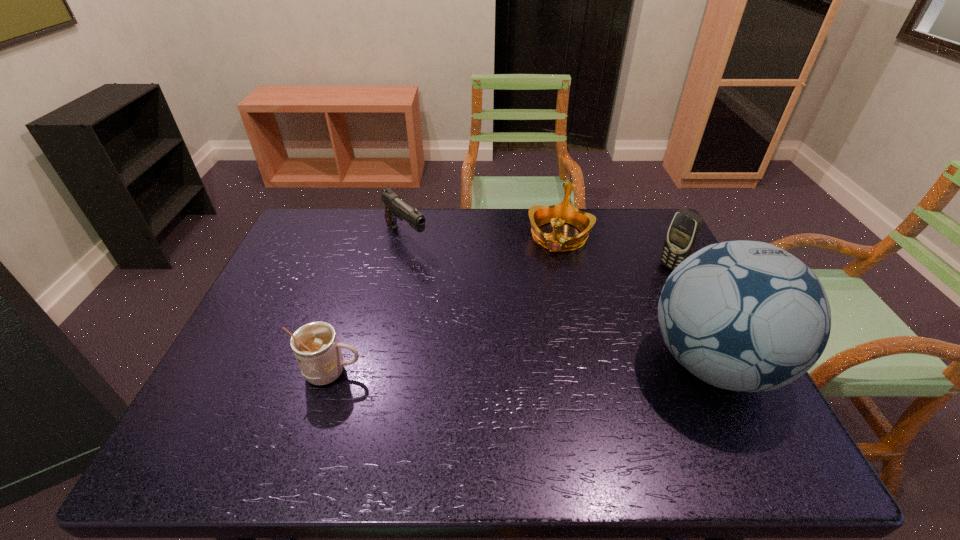
The height and width of the screenshot is (540, 960). I want to click on free space located in the direction the gun is aimed, so click(447, 275).

Locate an element on the screen. vacant space situated 0.370m in the direction the gun is aimed is located at coordinates [x=498, y=319].

This screenshot has height=540, width=960. What are the coordinates of `vacant region located 0.200m at the front emblem of the tiara` in the screenshot? It's located at (540, 304).

The width and height of the screenshot is (960, 540). In order to click on vacant space situated at the front emblem of the tiara in this screenshot , I will do `click(547, 282)`.

Locate an element on the screen. This screenshot has height=540, width=960. free space located 0.120m at the front emblem of the tiara is located at coordinates (546, 285).

The image size is (960, 540). I want to click on gun located at the far edge, so click(395, 208).

Locate an element on the screen. tiara at the far edge is located at coordinates tap(539, 215).

This screenshot has width=960, height=540. What are the coordinates of `cup present at the near edge` in the screenshot? It's located at pos(315,345).

You are a GUI agent. You are given a task and a screenshot of the screen. Output one action in this format:
    pyautogui.click(x=<x>, y=<y>)
    Task: Click on the soccer ball that is at the near edge
    This screenshot has width=960, height=540.
    Given the screenshot: What is the action you would take?
    pyautogui.click(x=747, y=316)

I want to click on soccer ball located in the right edge section of the desktop, so click(x=747, y=316).